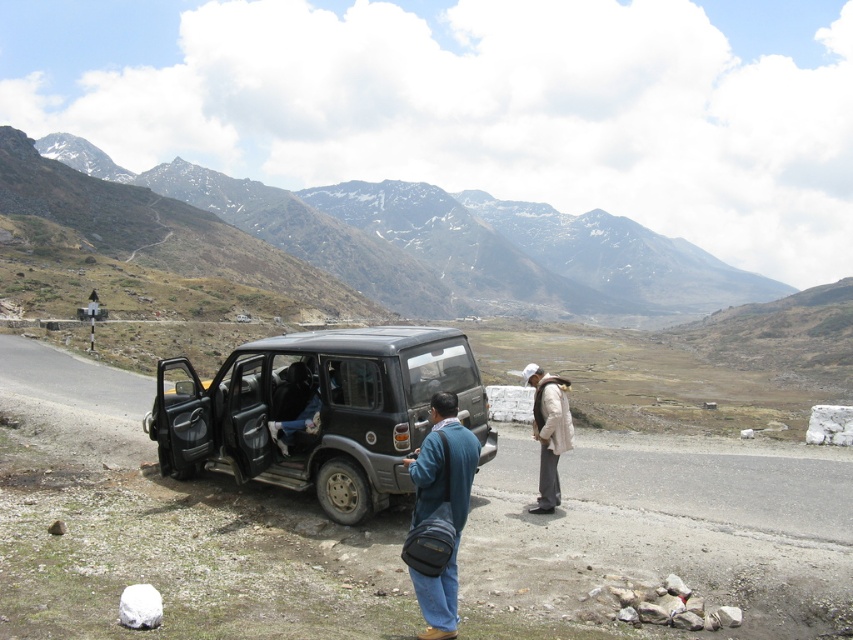
Question: Which object is closer to the camera taking this photo?

Choices:
 (A) white woolen jacket at center
 (B) blue fabric bag at center

Answer: (B)

Question: Considering the real-world distances, which object is farthest from the white woolen jacket at center?

Choices:
 (A) snowy rocky mountain at upper center
 (B) dark blue fabric pants at center
 (C) matte black jeep at center

Answer: (A)

Question: Estimate the real-world distances between objects in this image. Which object is farther from the snowy rocky mountain at upper center?

Choices:
 (A) blue fabric bag at center
 (B) matte black jeep at center

Answer: (A)

Question: Does snowy rocky mountain at upper center appear over blue fabric bag at center?

Choices:
 (A) yes
 (B) no

Answer: (A)

Question: Can you confirm if white woolen jacket at center is positioned below dark blue fabric pants at center?

Choices:
 (A) no
 (B) yes

Answer: (B)

Question: Where is snowy rocky mountain at upper center located in relation to dark blue fabric pants at center in the image?

Choices:
 (A) right
 (B) left

Answer: (B)